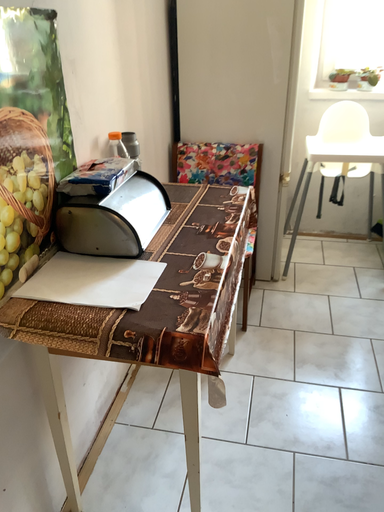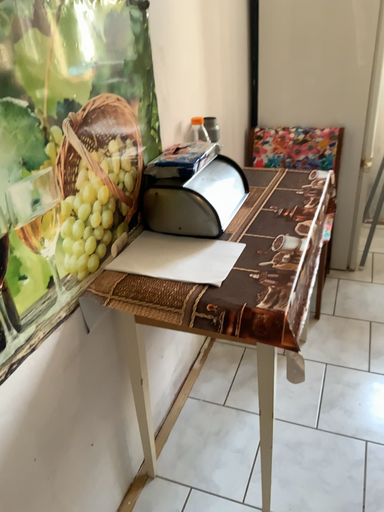
Question: Which way did the camera rotate in the video?

Choices:
 (A) rotated right
 (B) rotated left

Answer: (B)